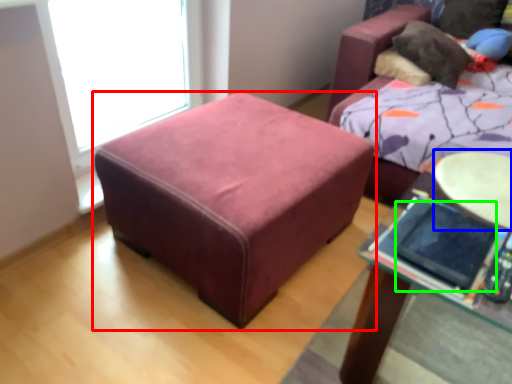
Question: Estimate the real-world distances between objects in this image. Which object is farther from table (highlighted by a red box), round table (highlighted by a blue box) or ipad (highlighted by a green box)?

Choices:
 (A) round table
 (B) ipad

Answer: (B)